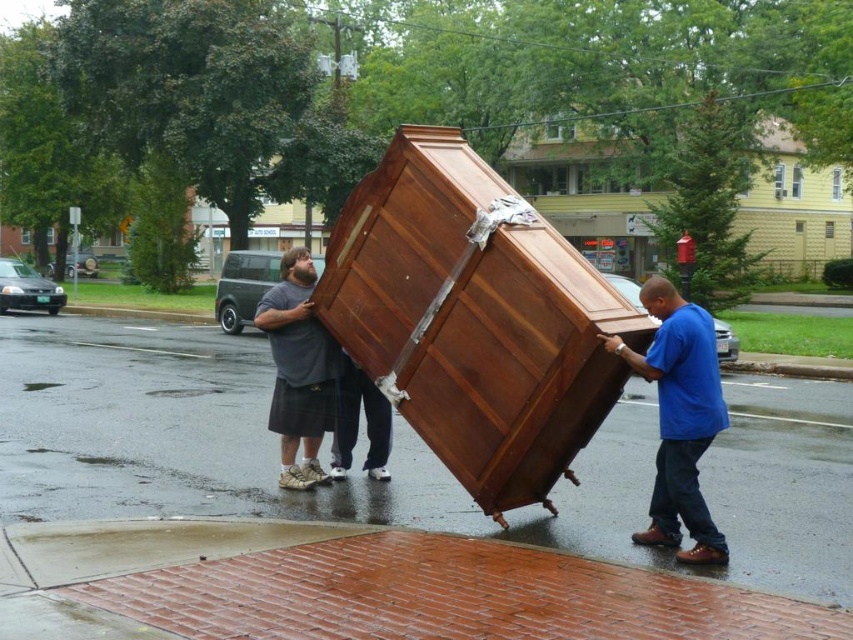
Who is more forward, (x=648, y=538) or (x=283, y=285)?

Point (x=648, y=538) is in front.

Between point (650, 355) and point (283, 436), which one is positioned behind?

Point (283, 436)

Is point (711, 372) less distant than point (329, 362)?

That is True.

Locate an element on the screen. blue cotton shirt at right is located at coordinates (679, 419).